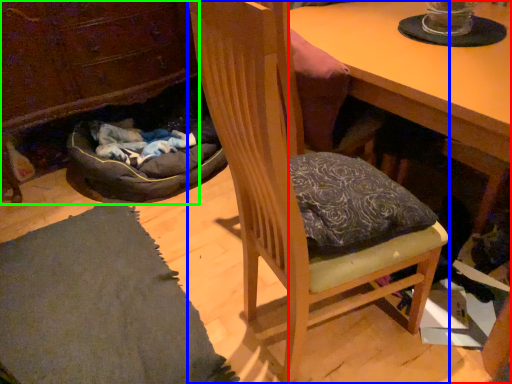
Question: Which is farther away from desk (highlighted by a red box)? chair (highlighted by a blue box) or cabinetry (highlighted by a green box)?

Choices:
 (A) chair
 (B) cabinetry

Answer: (B)